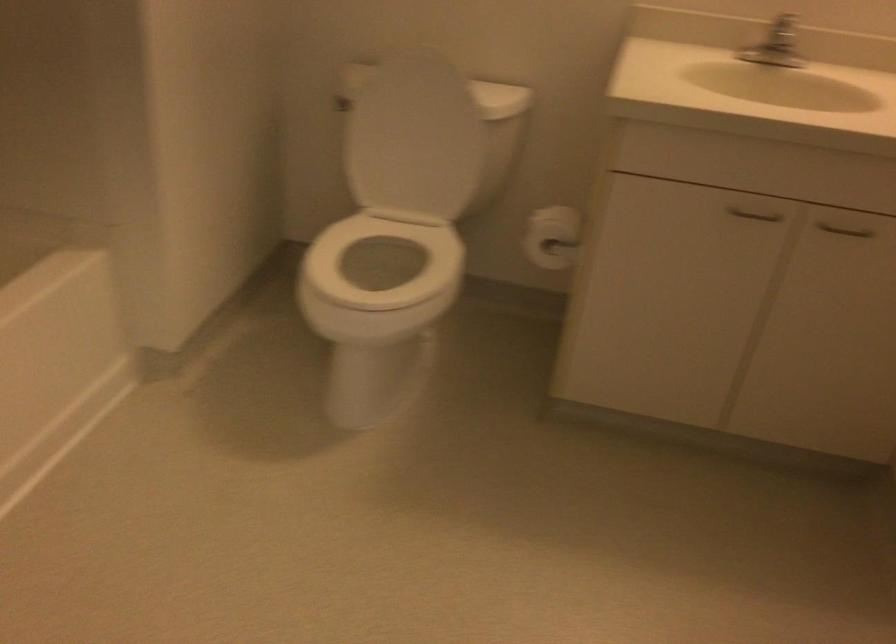
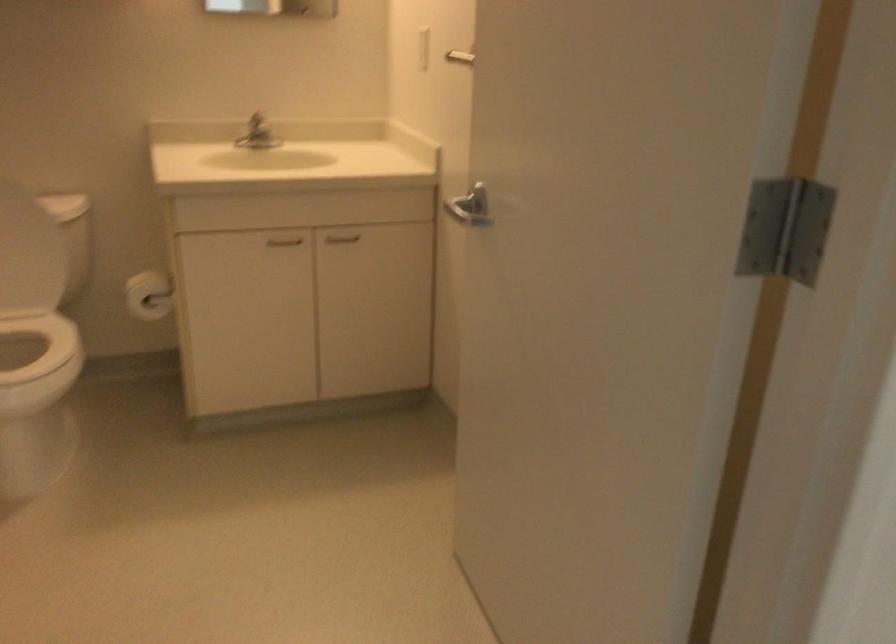
Find the pixel in the second image that matches (x=410, y=256) in the first image.

(22, 341)